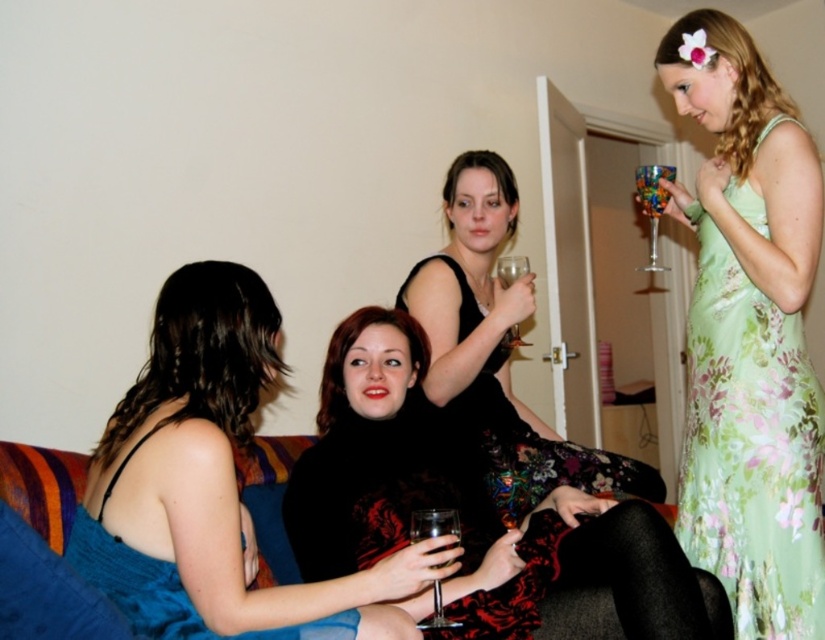
You are a photographer planning to capture a candid shot of the velvet dress at center in the living room scene. Given the coordinates provided, can you confirm if the velvet dress at center is positioned at point (382, 458)?

Yes, the velvet dress at center is located exactly at point (382, 458) as specified.

You are a photographer trying to capture a group photo of the women in the scene. The floral silk dress at upper right and the velvet couch at lower center are in your frame. Which object is positioned higher up in the image?

The floral silk dress at upper right is much taller as velvet couch at lower center, so it is positioned higher up in the image.